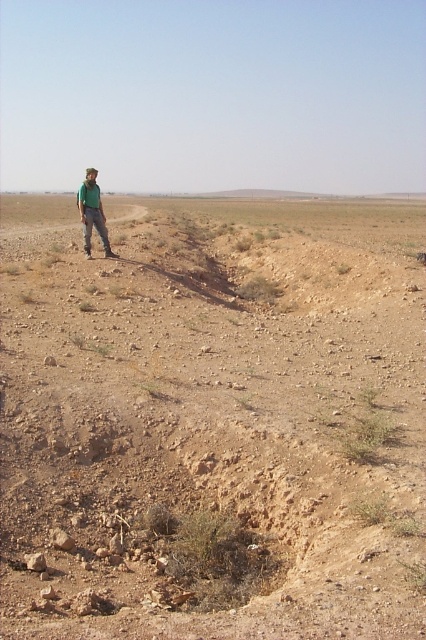
Question: Which of the following is the closest to the observer?

Choices:
 (A) dusty brown dirt field at center
 (B) green matte shirt at left

Answer: (A)

Question: Does dusty brown dirt field at center appear on the left side of green matte shirt at left?

Choices:
 (A) yes
 (B) no

Answer: (B)

Question: Does dusty brown dirt field at center appear under green matte shirt at left?

Choices:
 (A) yes
 (B) no

Answer: (B)

Question: Can you confirm if dusty brown dirt field at center is smaller than green matte shirt at left?

Choices:
 (A) yes
 (B) no

Answer: (B)